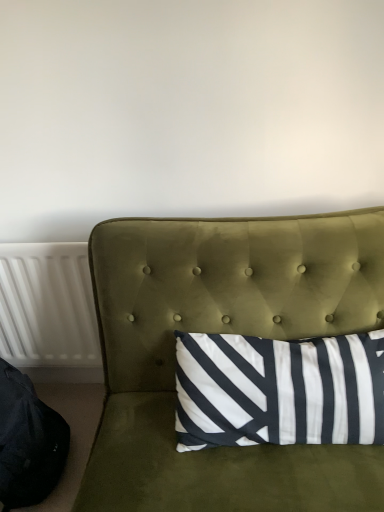
Question: From the image's perspective, is white plastic radiator at left positioned above or below velvet green studio couch at center?

Choices:
 (A) above
 (B) below

Answer: (A)

Question: In terms of height, does white plastic radiator at left look taller or shorter compared to velvet green studio couch at center?

Choices:
 (A) tall
 (B) short

Answer: (B)

Question: Which object is the closest to the black fabric bean bag chair at lower left?

Choices:
 (A) velvet green studio couch at center
 (B) white plastic radiator at left

Answer: (B)

Question: Considering the real-world distances, which object is farthest from the white plastic radiator at left?

Choices:
 (A) velvet green studio couch at center
 (B) black fabric bean bag chair at lower left

Answer: (A)